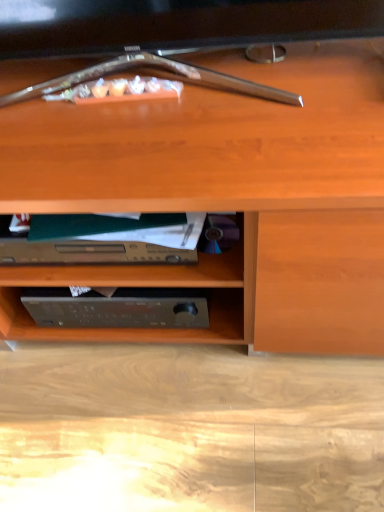
The image size is (384, 512). Describe the element at coordinates (140, 273) in the screenshot. I see `metallic silver dvd player at lower center` at that location.

The height and width of the screenshot is (512, 384). I want to click on metallic silver dvd player at lower center, so click(x=140, y=273).

You are a GUI agent. You are given a task and a screenshot of the screen. Output one action in this format:
    pyautogui.click(x=<x>, y=<y>)
    Task: Click on the metallic silver dvd player at lower center
    The width and height of the screenshot is (384, 512).
    Given the screenshot: What is the action you would take?
    pyautogui.click(x=140, y=273)